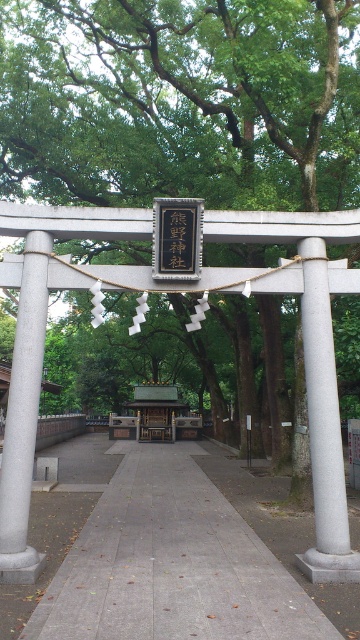
Question: Which of the following is the closest to the observer?

Choices:
 (A) (208, 104)
 (B) (177, 234)
 (C) (90, 532)

Answer: (B)

Question: Does gray concrete pavement at center appear on the left side of white stone pillar at right?

Choices:
 (A) yes
 (B) no

Answer: (A)

Question: Is gray concrete pavement at center to the left of white stone pillar at right from the viewer's perspective?

Choices:
 (A) yes
 (B) no

Answer: (A)

Question: Does gray concrete post at left have a lesser width compared to black paper at center?

Choices:
 (A) yes
 (B) no

Answer: (B)

Question: Which object is the farthest from the gray concrete post at left?

Choices:
 (A) black paper at center
 (B) green leafy tree at center
 (C) gray concrete pavement at center
 (D) white stone pillar at right

Answer: (B)

Question: Which point is closer to the camera?

Choices:
 (A) (186, 268)
 (B) (200, 134)

Answer: (A)